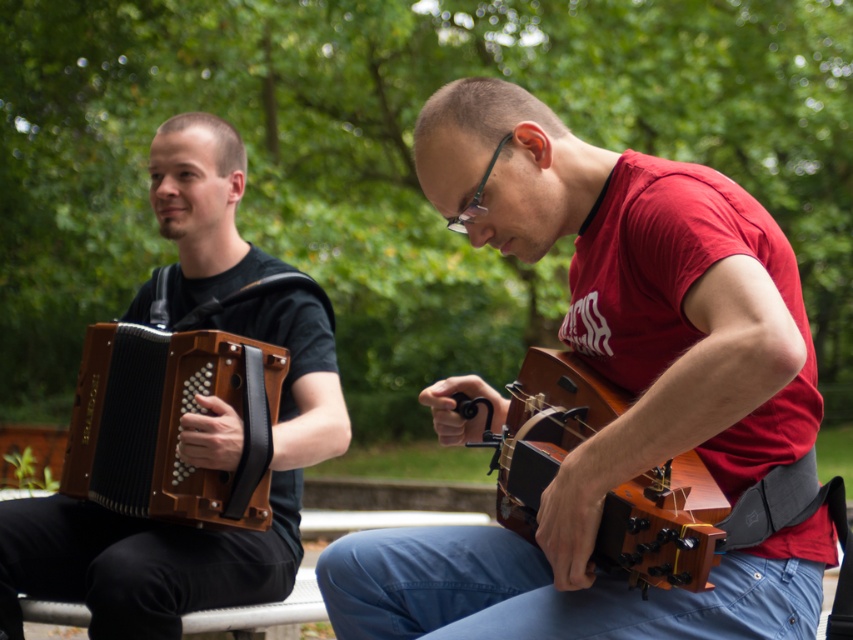
You are a photographer setting up for a shoot in the park. You need to position a light source to illuminate the wooden acoustic guitar at center and the brown wooden accordion at left. Since the acoustic guitar is above the accordion, where should you place the light to ensure both instruments are evenly lit?

The wooden acoustic guitar at center is located above the brown wooden accordion at left, so placing the light source directly in front and slightly above both instruments will ensure even illumination.

From the picture: You are setting up a music stand between the matte brown accordion at left and the wooden guitar at center. Which instrument should you place closer to the stand to ensure both can be easily reached?

The wooden guitar at center should be placed closer to the stand because it is smaller than the matte brown accordion at left, allowing for easier reach and better accessibility for both musicians.

Where is the matte brown accordion at left located in the image?

The matte brown accordion at left is located at point (271, 429) in the image.